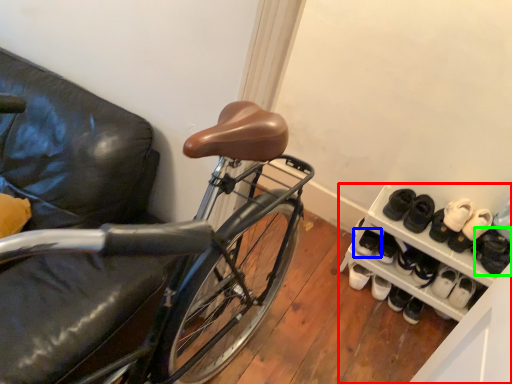
Question: Which object is positioned farthest from cabinetry (highlighted by a red box)? Select from footwear (highlighted by a blue box) and footwear (highlighted by a green box).

Choices:
 (A) footwear
 (B) footwear

Answer: (B)